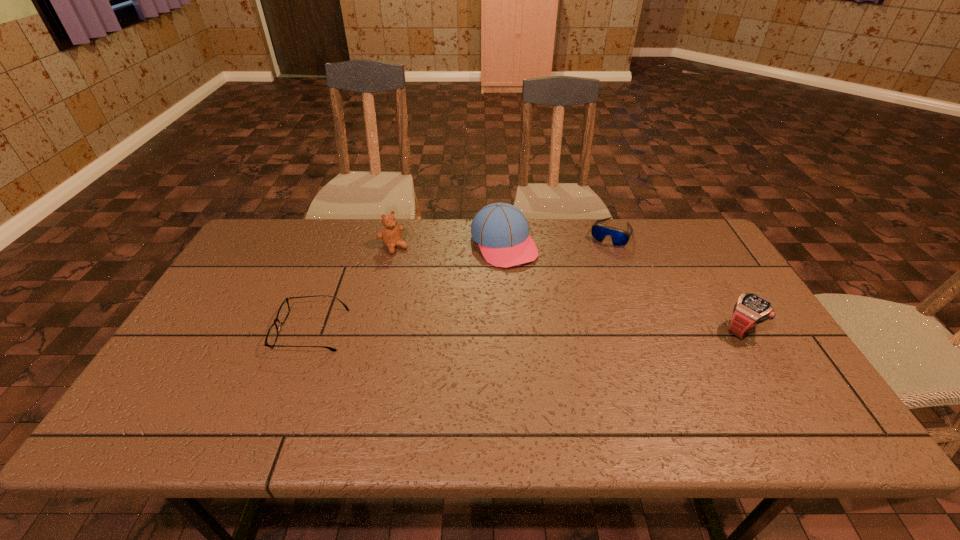
Find the location of a particular element. Image resolution: width=960 pixels, height=540 pixels. vacant space situated 0.340m on the front-facing side of the fourth object from left to right is located at coordinates (571, 313).

The height and width of the screenshot is (540, 960). Find the location of `teddy bear located in the far edge section of the desktop`. teddy bear located in the far edge section of the desktop is located at coordinates (391, 236).

You are a GUI agent. You are given a task and a screenshot of the screen. Output one action in this format:
    pyautogui.click(x=<x>, y=<y>)
    Task: Click on the baseball cap that is at the far edge
    
    Given the screenshot: What is the action you would take?
    pyautogui.click(x=501, y=230)

Locate an element on the screen. The image size is (960, 540). sunglasses that is at the far edge is located at coordinates (619, 237).

Image resolution: width=960 pixels, height=540 pixels. I want to click on object that is at the right edge, so click(x=750, y=309).

In the image, there is a desktop. At what (x,y) coordinates should I click in order to perform the action: click on vacant area at the far edge. Please return your answer as a coordinate pair (x, y). The image size is (960, 540). Looking at the image, I should click on (340, 249).

In the image, there is a desktop. Identify the location of vacant space at the near edge. (718, 384).

The height and width of the screenshot is (540, 960). Identify the location of vacant space at the left edge. (258, 286).

Find the location of a particular element. The width and height of the screenshot is (960, 540). free space at the right edge is located at coordinates tap(773, 353).

This screenshot has width=960, height=540. What are the coordinates of `vacant space at the far left corner` in the screenshot? It's located at (263, 242).